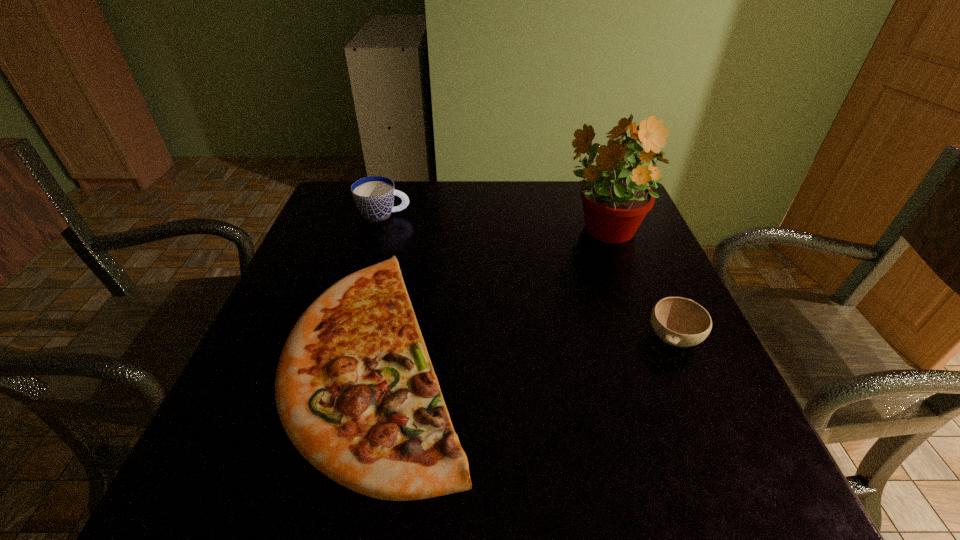
What are the coordinates of `empty space that is in between the flowerpot and the cup` in the screenshot? It's located at (493, 223).

The width and height of the screenshot is (960, 540). In order to click on object that can be found as the second closest to the bowl in this screenshot , I will do `click(355, 389)`.

Point out which object is positioned as the second nearest to the tallest object. Please provide its 2D coordinates. Your answer should be formatted as a tuple, i.e. [(x, y)], where the tuple contains the x and y coordinates of a point satisfying the conditions above.

[(355, 389)]

I want to click on vacant region that satisfies the following two spatial constraints: 1. on the side of the tallest object with the handle; 2. on the left side of the cup, so click(379, 232).

The height and width of the screenshot is (540, 960). Find the location of `blank space that satisfies the following two spatial constraints: 1. on the side of the third shortest object with the handle; 2. on the left side of the flowerpot`. blank space that satisfies the following two spatial constraints: 1. on the side of the third shortest object with the handle; 2. on the left side of the flowerpot is located at coordinates (379, 232).

Locate an element on the screen. The width and height of the screenshot is (960, 540). free space that satisfies the following two spatial constraints: 1. on the back side of the pizza; 2. on the side of the cup with the handle is located at coordinates (410, 215).

Find the location of `free location that satisfies the following two spatial constraints: 1. on the back side of the pizza; 2. on the right side of the bowl`. free location that satisfies the following two spatial constraints: 1. on the back side of the pizza; 2. on the right side of the bowl is located at coordinates (383, 338).

You are a GUI agent. You are given a task and a screenshot of the screen. Output one action in this format:
    pyautogui.click(x=<x>, y=<y>)
    Task: Click on the vacant region that satisfies the following two spatial constraints: 1. on the front side of the bowl; 2. on the left side of the flowerpot
    
    Given the screenshot: What is the action you would take?
    pyautogui.click(x=640, y=338)

Find the location of a particular element. This screenshot has width=960, height=540. free location that satisfies the following two spatial constraints: 1. on the side of the cup with the handle; 2. on the right side of the flowerpot is located at coordinates (379, 232).

Where is `vacant space that satisfies the following two spatial constraints: 1. on the side of the bowl with the handle; 2. on the right side of the third shortest object`? Image resolution: width=960 pixels, height=540 pixels. vacant space that satisfies the following two spatial constraints: 1. on the side of the bowl with the handle; 2. on the right side of the third shortest object is located at coordinates (348, 338).